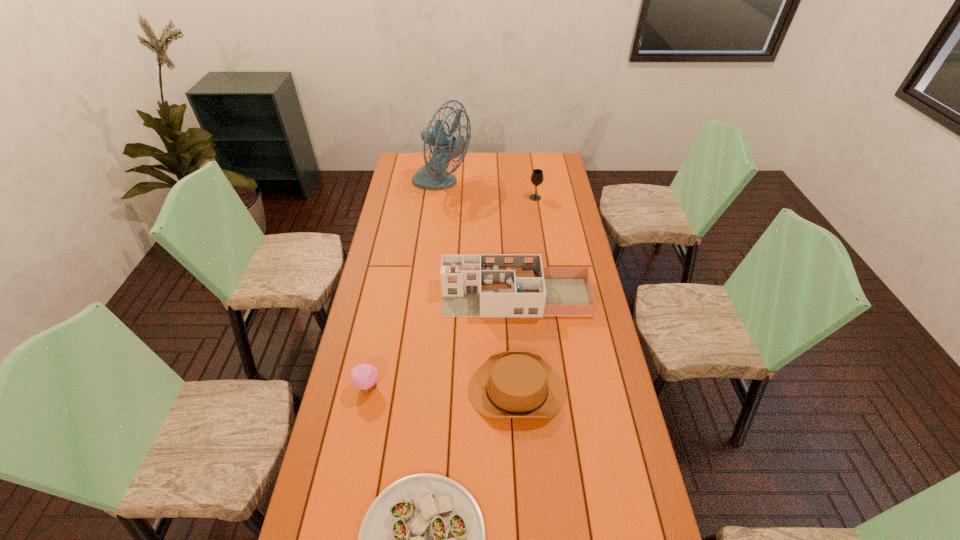
You are a GUI agent. You are given a task and a screenshot of the screen. Output one action in this format:
    pyautogui.click(x=<x>, y=<y>)
    Task: Click on the vacant space at the far edge of the desktop
    This screenshot has width=960, height=540.
    Given the screenshot: What is the action you would take?
    pyautogui.click(x=479, y=173)

I want to click on vacant space at the left edge of the desktop, so click(353, 474).

Where is `free space at the right edge`? The image size is (960, 540). free space at the right edge is located at coordinates (606, 519).

Where is `vacant space at the far left corner of the desktop`? Image resolution: width=960 pixels, height=540 pixels. vacant space at the far left corner of the desktop is located at coordinates (411, 157).

The image size is (960, 540). Identify the location of free point between the cowboy hat and the dollhouse. (516, 343).

At what (x,y) coordinates should I click in order to perform the action: click on free space between the wineglass and the tallest object. Please return your answer as a coordinate pair (x, y). This screenshot has width=960, height=540. Looking at the image, I should click on (489, 191).

At what (x,y) coordinates should I click in order to perform the action: click on vacant region between the tallest object and the wineglass. Please return your answer as a coordinate pair (x, y). The width and height of the screenshot is (960, 540). Looking at the image, I should click on (489, 191).

Locate an element on the screen. This screenshot has height=540, width=960. free spot between the cowboy hat and the cupcake is located at coordinates (443, 389).

Image resolution: width=960 pixels, height=540 pixels. What are the coordinates of `free space between the tallest object and the cupcake` in the screenshot? It's located at (404, 286).

The image size is (960, 540). In order to click on vacant point located between the cupcake and the tallest object in this screenshot , I will do `click(404, 286)`.